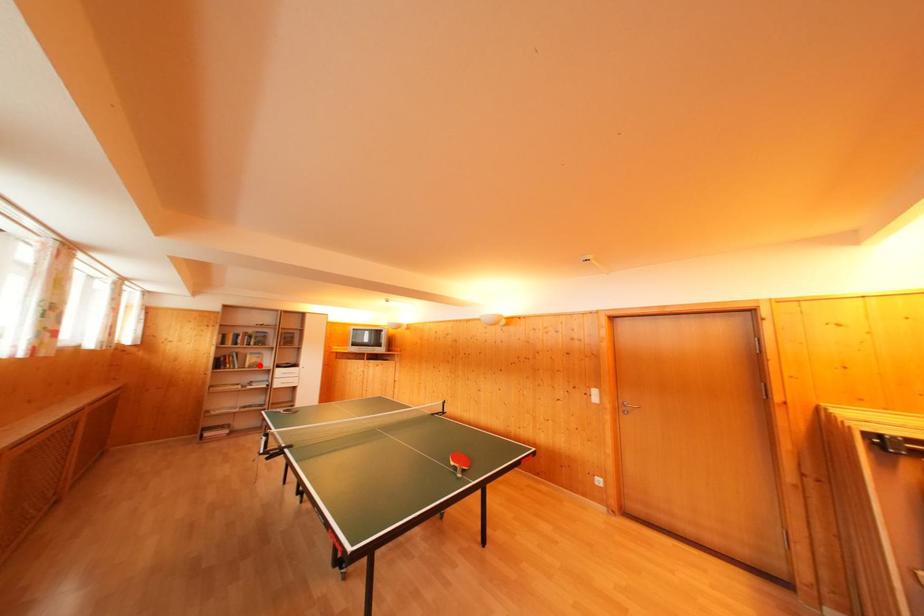
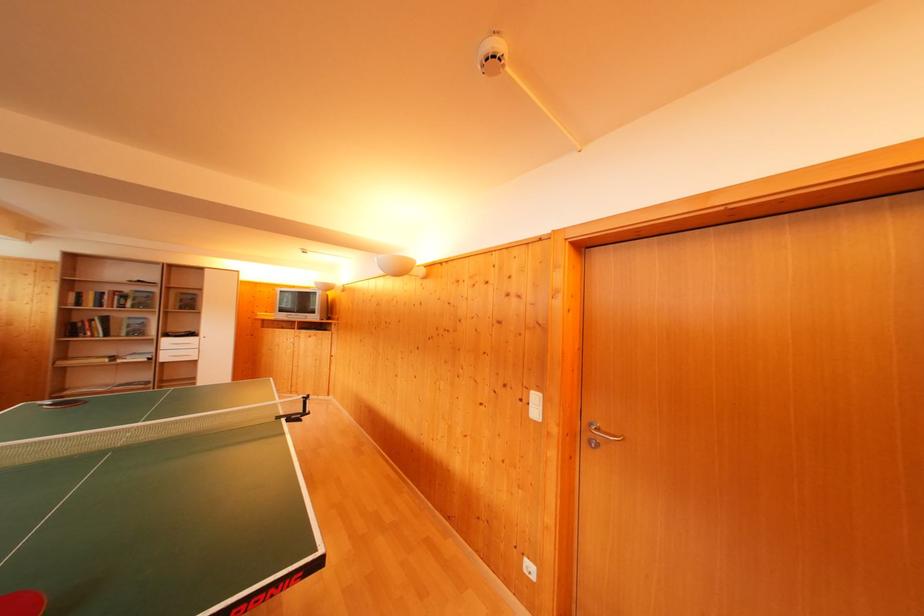
Question: I am providing you with two images of the same scene from different viewpoints. Image1 has a red point marked. In image2, the corresponding 3D location appears at what relative position? Reply with the corresponding letter.

Choices:
 (A) Closer
 (B) Farther

Answer: (A)